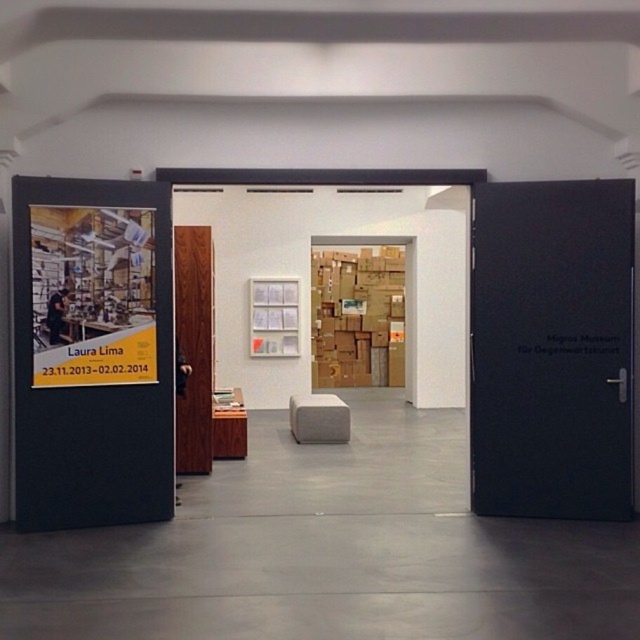
You are an art curator standing at the entrance of the gallery. You need to move the beige fabric stool at center to the storage room located behind the wooden door at center. Considering their sizes, will the stool fit through the door when carried normally?

The wooden door at center is much taller than the beige fabric stool at center, so the stool will fit through the door when carried normally.

You are standing at the entrance of the art gallery. You want to exit through the black matte door at right. Which direction should you walk towards?

Walk towards the right side of the entrance since the black matte door at right is located at point [552,348], which is on the right side from the entrance perspective.

You are an art enthusiast visiting the gallery and want to sit down to rest. You notice the wooden door at center and the beige fabric stool at center. Which one is more suitable for sitting?

The beige fabric stool at center is more suitable for sitting because it is larger than the wooden door at center, making it a better option for resting.